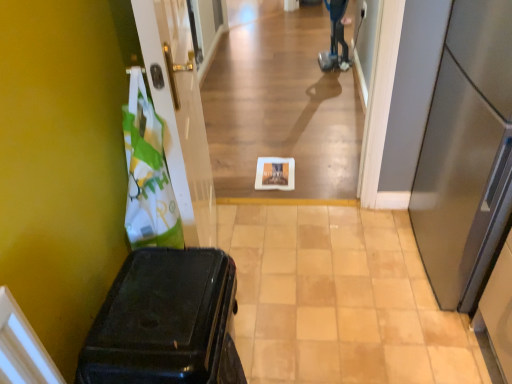
Identify the location of free spot above shiny black suitcase at left (from a real-world perspective). This screenshot has height=384, width=512. (151, 312).